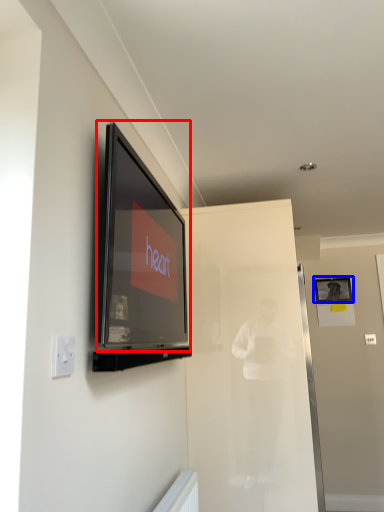
Question: Which object is closer to the camera taking this photo, television (highlighted by a red box) or picture frame (highlighted by a blue box)?

Choices:
 (A) television
 (B) picture frame

Answer: (A)